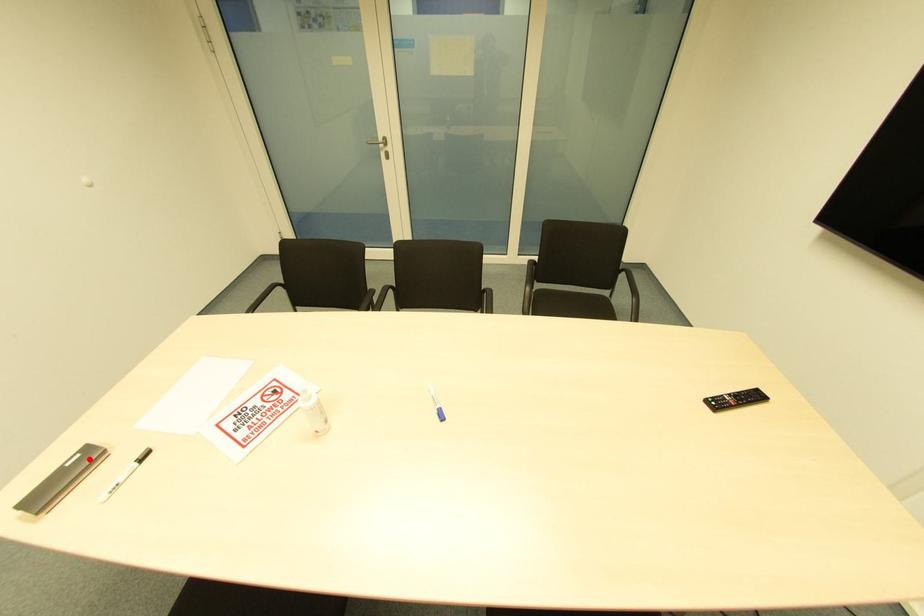
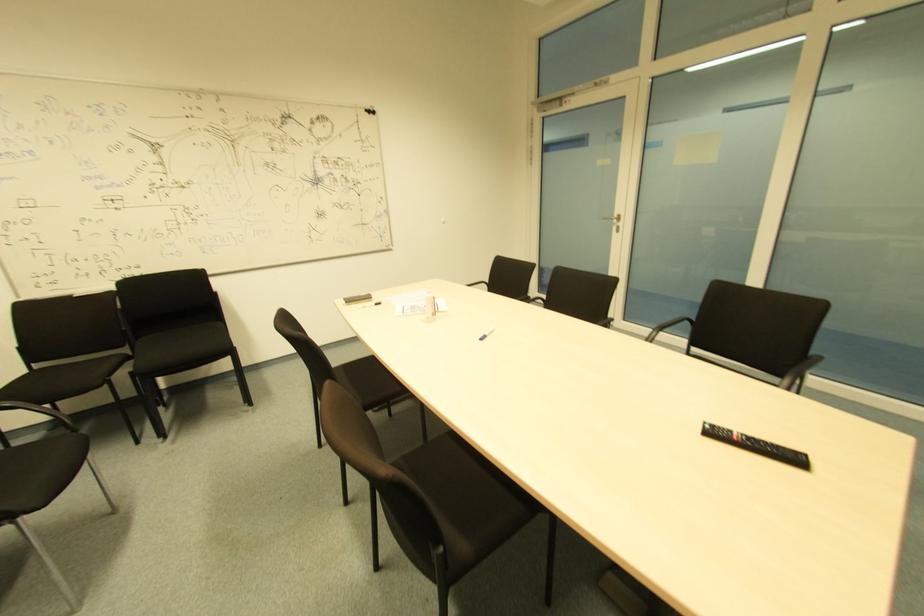
Find the pixel in the second image that matches the highlighted location in the first image.

(365, 301)